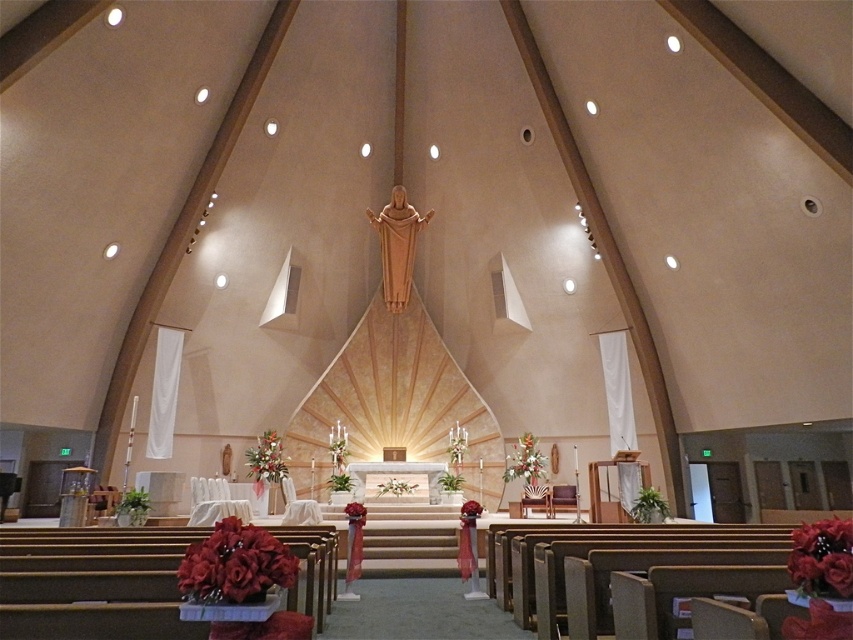
You are a florist who needs to place a new arrangement between the velvety red bouquet at lower left and the silky red roses at lower right. Which arrangement should you choose to maintain visual balance if you want the new arrangement to be smaller than the existing ones?

You should place the new arrangement closer to the silky red roses at lower right since the velvety red bouquet at lower left is larger and the smaller new arrangement would balance better near the smaller existing one.

You are standing at the entrance of the modern church and see two floral arrangements, the velvety red bouquet at lower left and the silky red roses at lower right. Which one is located more to the left side of the church?

The velvety red bouquet at lower left is positioned on the left side of silky red roses at lower right, so it is more to the left side of the church.